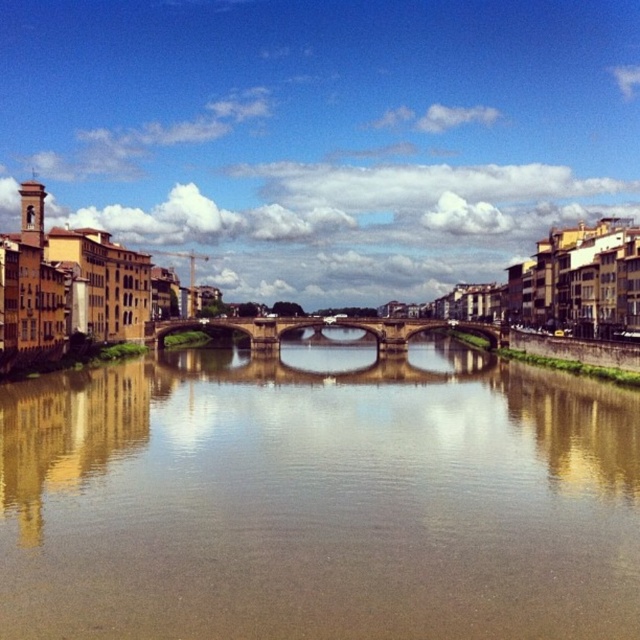
Question: Which point is farther from the camera taking this photo?

Choices:
 (A) (276, 333)
 (B) (284, 412)

Answer: (A)

Question: In this image, where is brown reflective water at center located relative to stone arch bridge at center?

Choices:
 (A) above
 (B) below

Answer: (B)

Question: Does brown reflective water at center appear under stone arch bridge at center?

Choices:
 (A) yes
 (B) no

Answer: (A)

Question: In this image, where is brown reflective water at center located relative to stone arch bridge at center?

Choices:
 (A) left
 (B) right

Answer: (A)

Question: Which of the following is the closest to the observer?

Choices:
 (A) brown reflective water at center
 (B) stone arch bridge at center

Answer: (A)